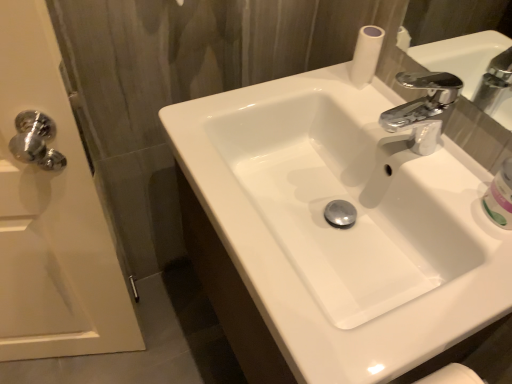
The height and width of the screenshot is (384, 512). I want to click on vacant space to the left of white glossy mouthwash at right, so click(442, 191).